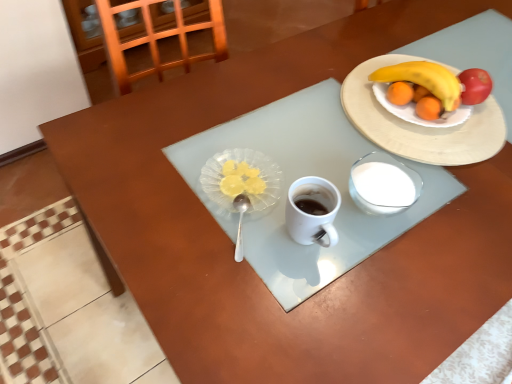
Locate an element on the screen. vacant space in front of translucent glass plate at center is located at coordinates [221, 258].